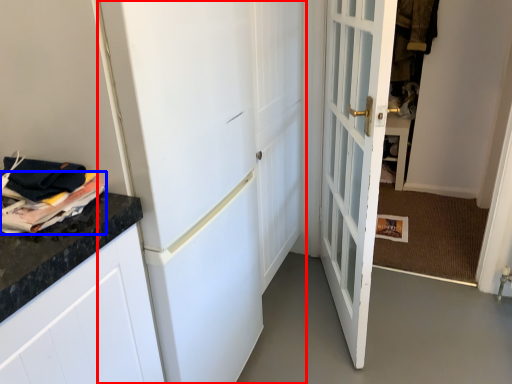
Question: Which object is further to the camera taking this photo, door (highlighted by a red box) or magazine (highlighted by a blue box)?

Choices:
 (A) door
 (B) magazine

Answer: (B)